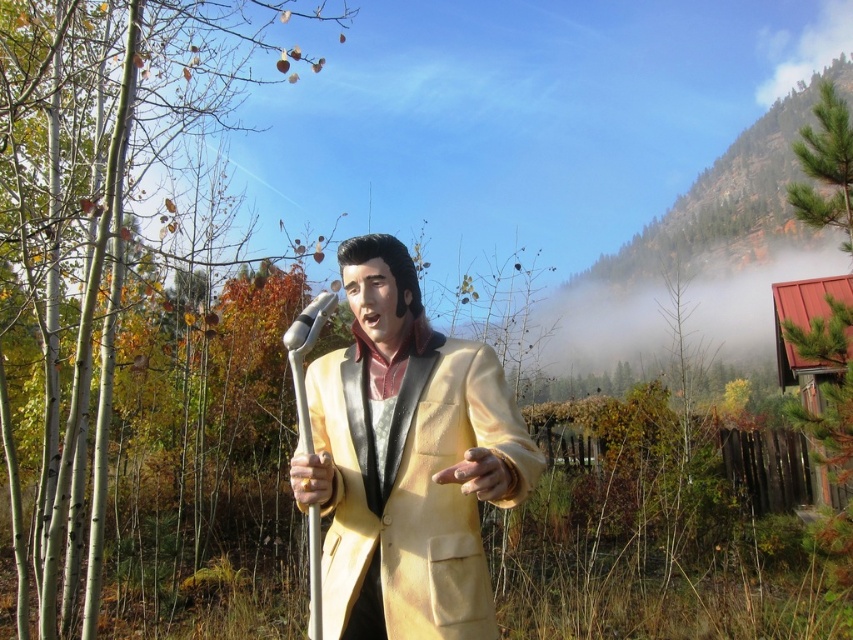
Who is higher up, matte gold suit at center or golden leather glove at center?

matte gold suit at center is higher up.

Can you confirm if matte gold suit at center is taller than golden leather glove at center?

Yes, matte gold suit at center is taller than golden leather glove at center.

Who is more distant from viewer, (x=531, y=442) or (x=502, y=472)?

Point (x=531, y=442)

The width and height of the screenshot is (853, 640). Find the location of `matte gold suit at center`. matte gold suit at center is located at coordinates (407, 460).

Is the position of matte gold suit at center less distant than that of golden metallic hand at center?

That is True.

Can you confirm if matte gold suit at center is positioned below golden metallic hand at center?

No.

Is point (409, 464) more distant than point (323, 493)?

Yes, it is behind point (323, 493).

Find the location of a particular element. matte gold suit at center is located at coordinates (407, 460).

Is golden leather glove at center shorter than golden metallic hand at center?

Yes, golden leather glove at center is shorter than golden metallic hand at center.

Does point (479, 472) come farther from viewer compared to point (294, 472)?

No, (479, 472) is closer to viewer.

Identify the location of golden leather glove at center. Image resolution: width=853 pixels, height=640 pixels. (479, 474).